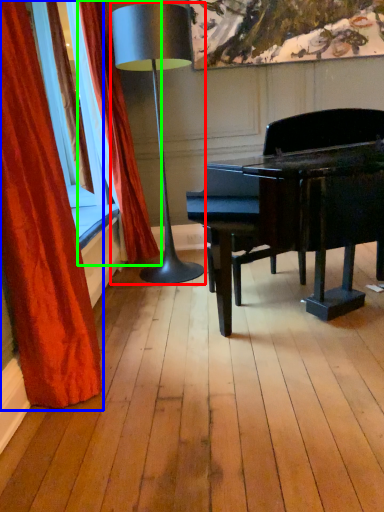
Question: Which object is the closest to the lamp (highlighted by a red box)? Choose among these: curtain (highlighted by a blue box) or curtain (highlighted by a green box).

Choices:
 (A) curtain
 (B) curtain

Answer: (B)